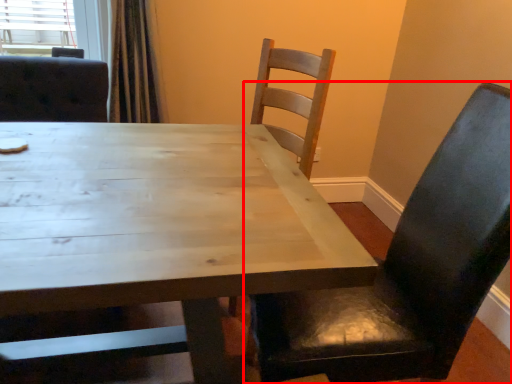
Question: Considering the relative positions of chair (annotated by the red box) and table in the image provided, where is chair (annotated by the red box) located with respect to the staircase?

Choices:
 (A) left
 (B) right

Answer: (B)